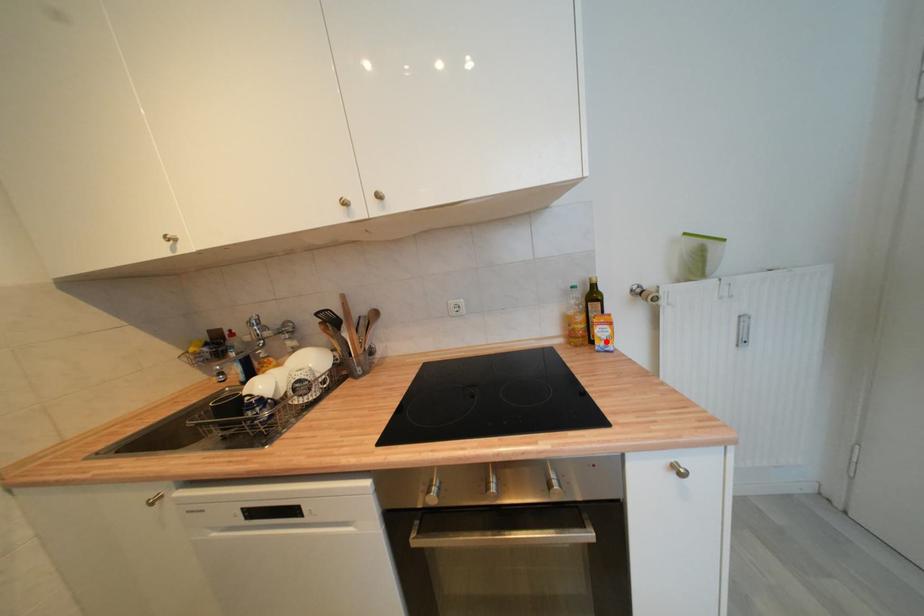
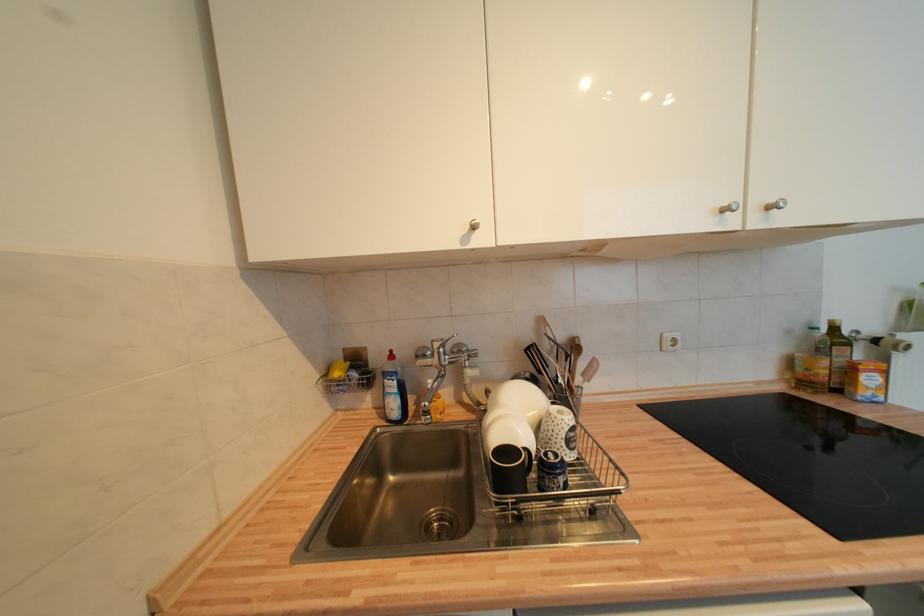
Question: I am providing you with two images of the same scene from different viewpoints. A red point is marked on the first image. Can you still see the location of the red point in image 2?

Choices:
 (A) Yes
 (B) No

Answer: (A)